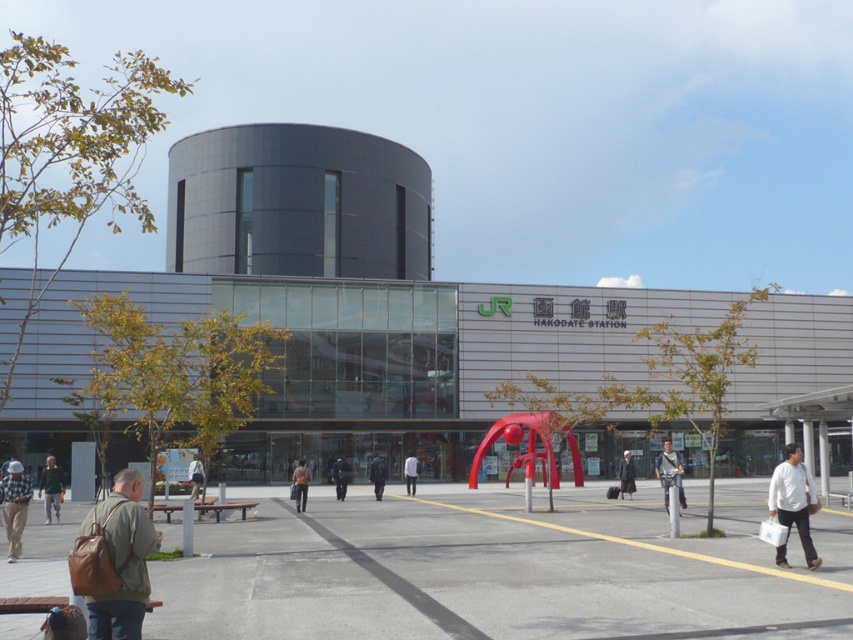
Looking at this image, you are a traveler at Hakodate Station and see your two bags, the brown leather bag at lower left and the orange fabric bag at center. Which bag is positioned higher up?

The brown leather bag at lower left is positioned above the orange fabric bag at center.

What is the exact location of the checkered fabric shirt at lower left in the image?

The checkered fabric shirt at lower left is located at point (15, 506).